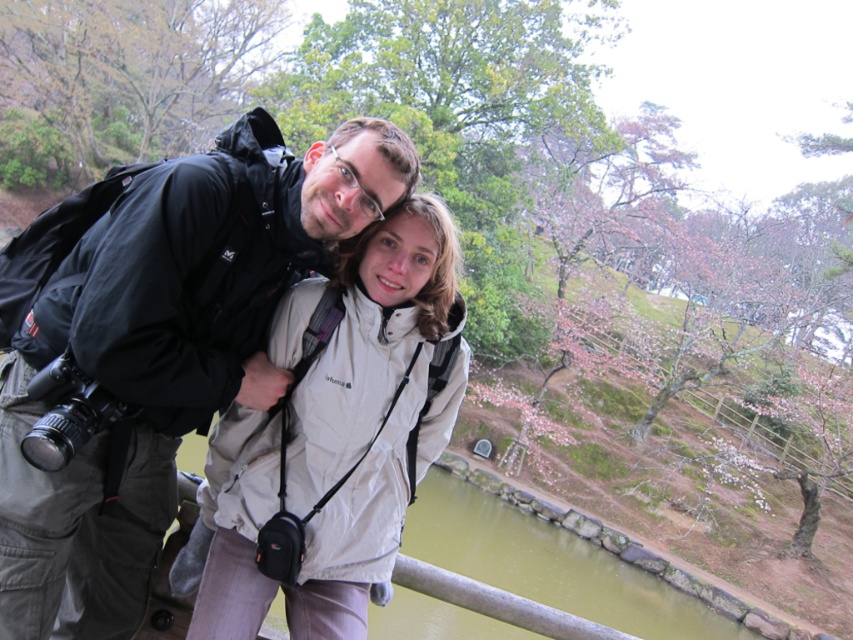
Is matte black jacket at left positioned behind white matte jacket at center?

No.

Based on the photo, is matte black jacket at left above white matte jacket at center?

Indeed, matte black jacket at left is positioned over white matte jacket at center.

Is point (260, 397) behind point (265, 493)?

Yes, it is.

Where is `matte black jacket at left`? This screenshot has width=853, height=640. matte black jacket at left is located at coordinates (167, 349).